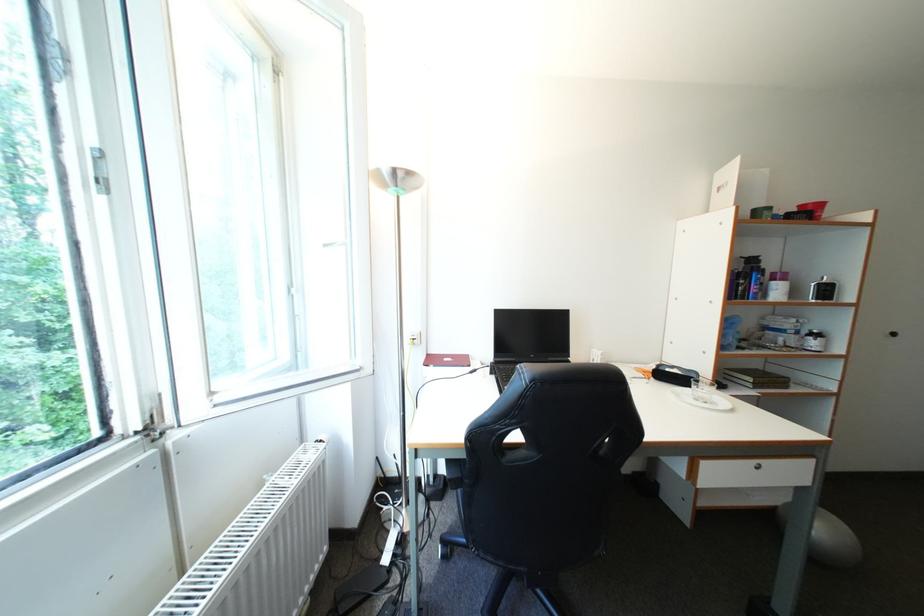
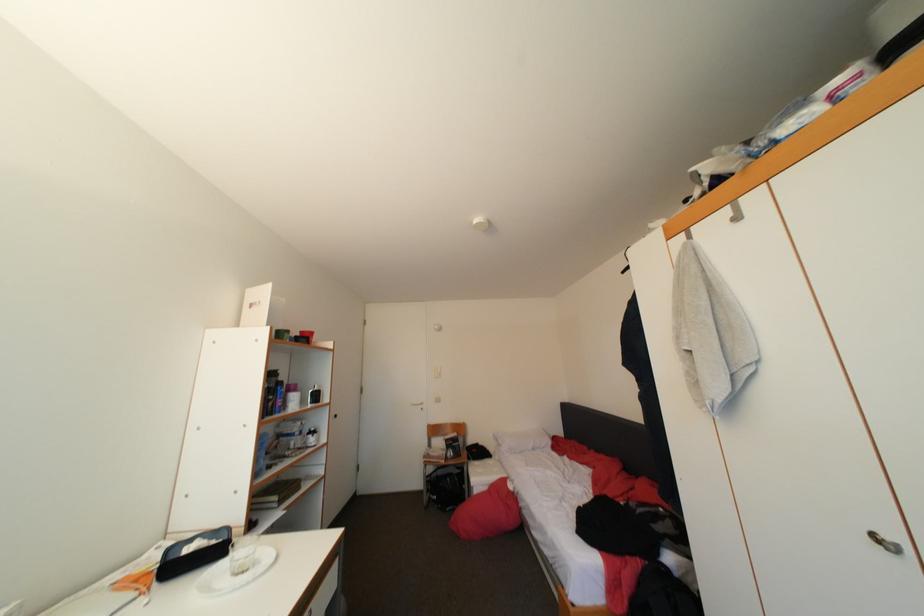
Question: The images are taken continuously from a first-person perspective. In which direction is your viewpoint rotating?

Choices:
 (A) Left
 (B) Right
 (C) Up
 (D) Down

Answer: (B)